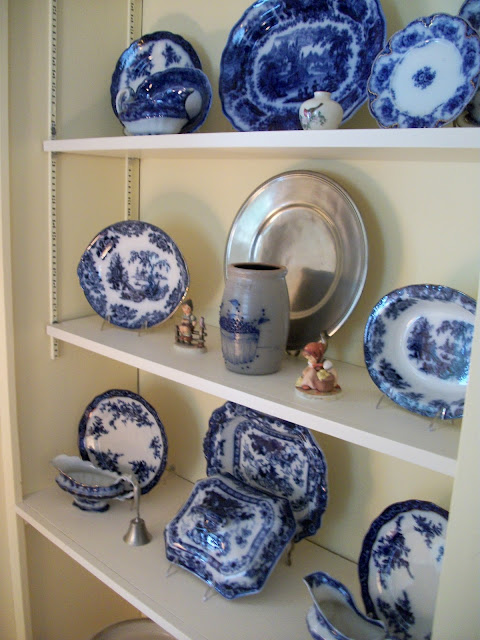
The image size is (480, 640). In order to click on gravy bowls in this screenshot , I will do `click(331, 614)`, `click(88, 475)`.